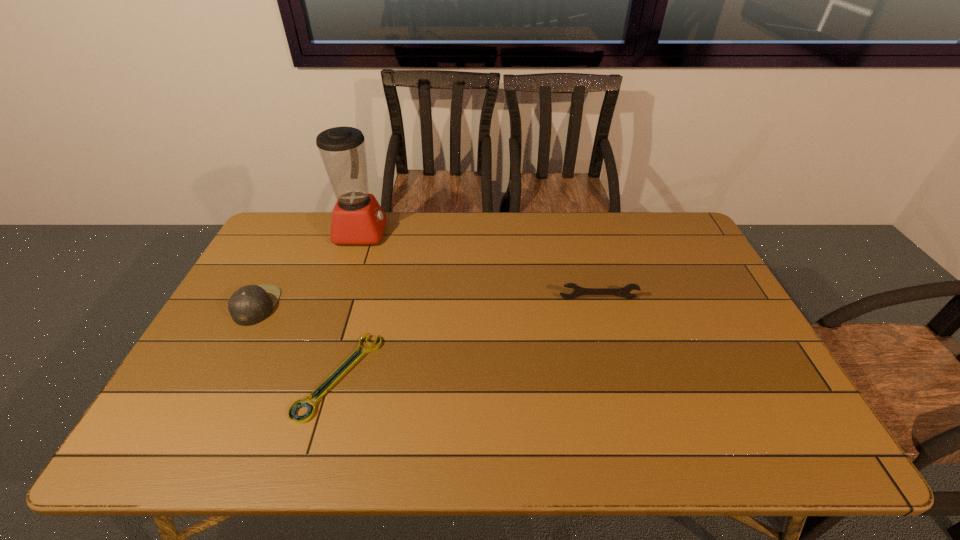
At what (x,y) coordinates should I click in order to perform the action: click on blender. Please return your answer as a coordinate pair (x, y). This screenshot has height=540, width=960. Looking at the image, I should click on (358, 219).

The width and height of the screenshot is (960, 540). I want to click on the tallest object, so click(358, 219).

The image size is (960, 540). Identify the location of the third shortest object. (251, 304).

I want to click on the leftmost object, so click(251, 304).

Identify the location of the farther wrench. (578, 291).

Image resolution: width=960 pixels, height=540 pixels. Identify the location of the rightmost object. (578, 291).

Locate an element on the screen. Image resolution: width=960 pixels, height=540 pixels. the shorter wrench is located at coordinates (357, 355).

The width and height of the screenshot is (960, 540). What are the coordinates of `the nearer wrench` in the screenshot? It's located at (357, 355).

This screenshot has width=960, height=540. I want to click on vacant space located on the front of the farthest object near the controls, so click(x=454, y=232).

Find the location of a particular element. This screenshot has width=960, height=540. free space located 0.220m on the brim of the cap is located at coordinates (351, 305).